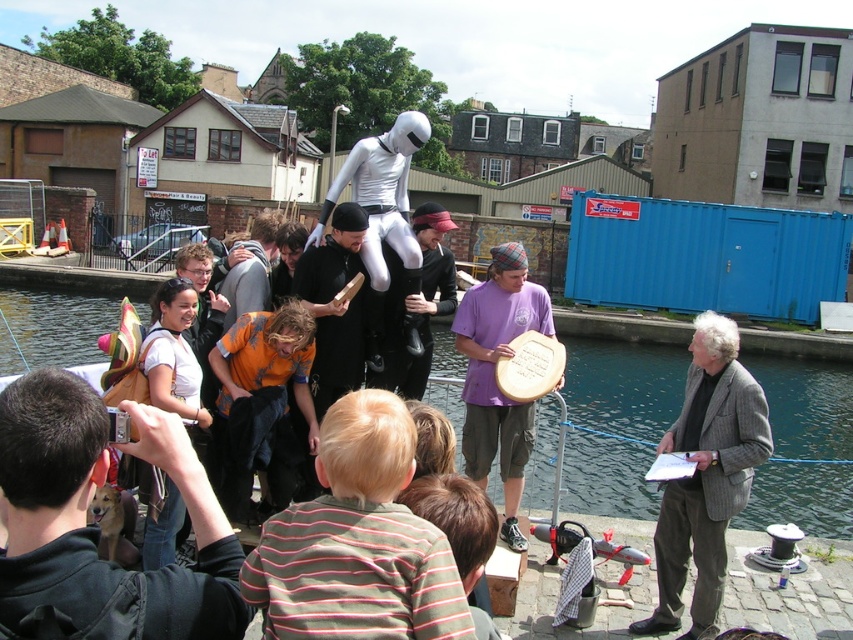
You are standing in the canal scene and want to walk from point A to point B. Point A is at coordinate point (746, 355) and point B is at coordinate point (466, 330). Which point is closer to you when you start walking?

Point A at coordinate point (746, 355) is closer to you than point B at coordinate point (466, 330) because it is further to the viewer according to the description.